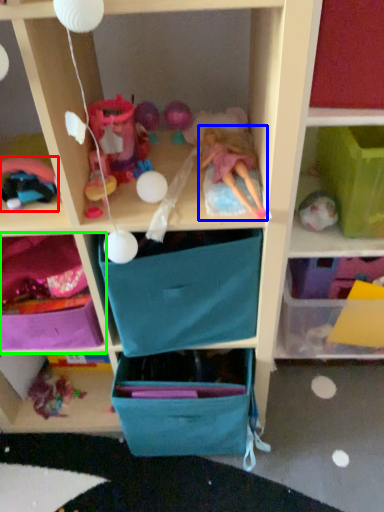
Question: Based on their relative distances, which object is farther from toy (highlighted by a red box)? Choose from doll (highlighted by a blue box) and shelf (highlighted by a green box).

Choices:
 (A) doll
 (B) shelf

Answer: (A)